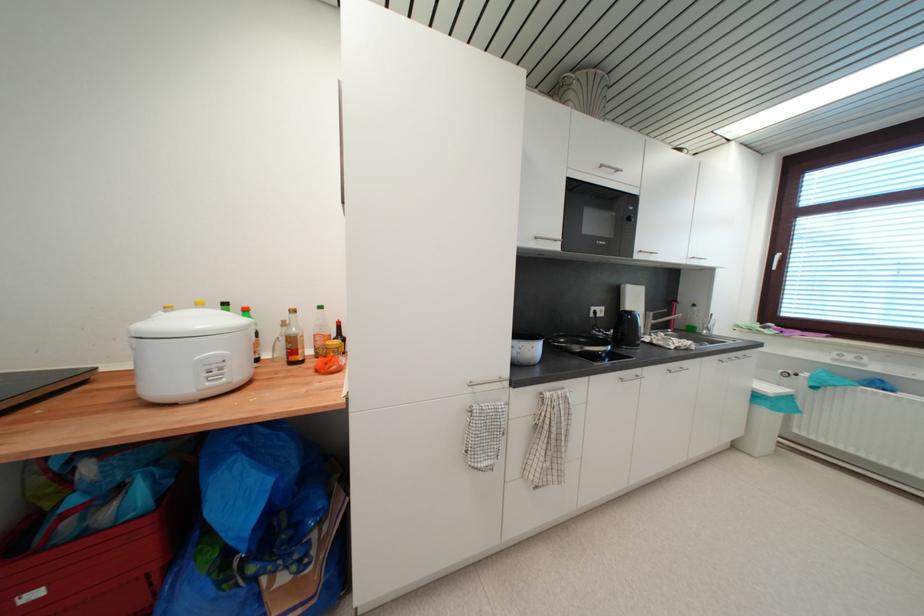
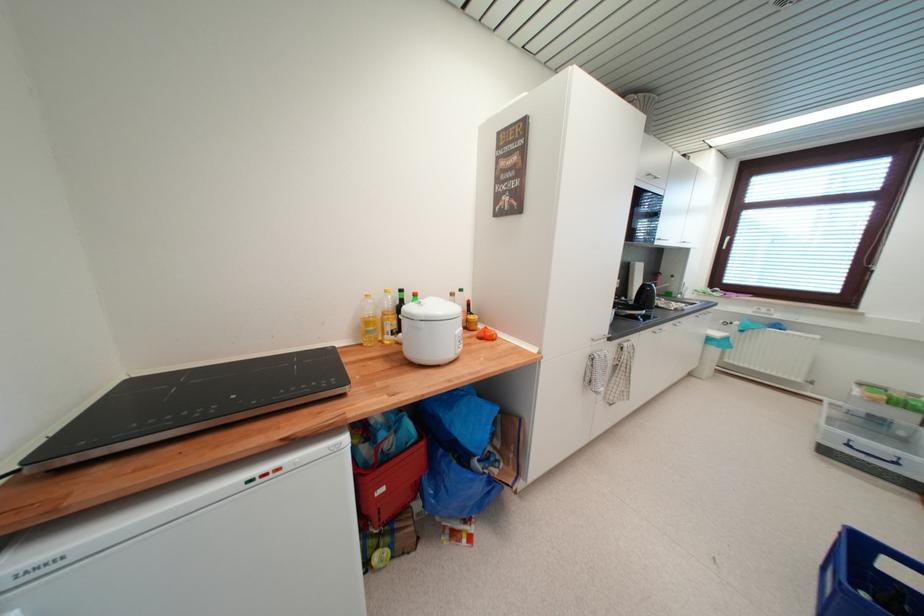
The point at (x=136, y=517) is marked in the first image. Where is the corresponding point in the second image?

(418, 444)